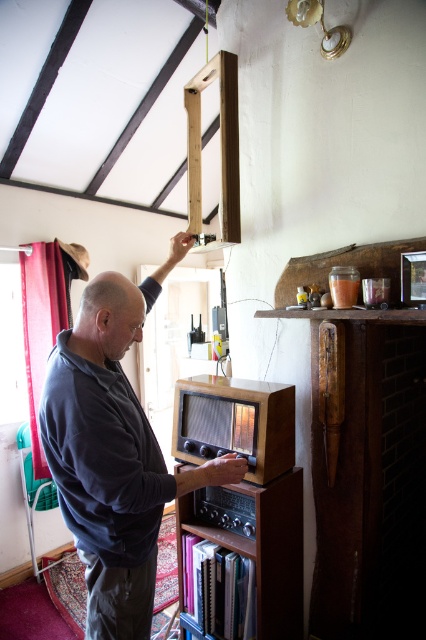
Question: Which of the following is the farthest from the observer?

Choices:
 (A) wooden bookshelf at center
 (B) dark blue sweater at lower left

Answer: (A)

Question: Among these objects, which one is farthest from the camera?

Choices:
 (A) wooden bookshelf at center
 (B) dark blue sweater at lower left

Answer: (A)

Question: Can you confirm if dark blue sweater at lower left is positioned to the left of wooden bookshelf at center?

Choices:
 (A) yes
 (B) no

Answer: (A)

Question: From the image, what is the correct spatial relationship of dark blue sweater at lower left in relation to wooden bookshelf at center?

Choices:
 (A) below
 (B) above

Answer: (B)

Question: Observing the image, what is the correct spatial positioning of dark blue sweater at lower left in reference to wooden bookshelf at center?

Choices:
 (A) below
 (B) above

Answer: (B)